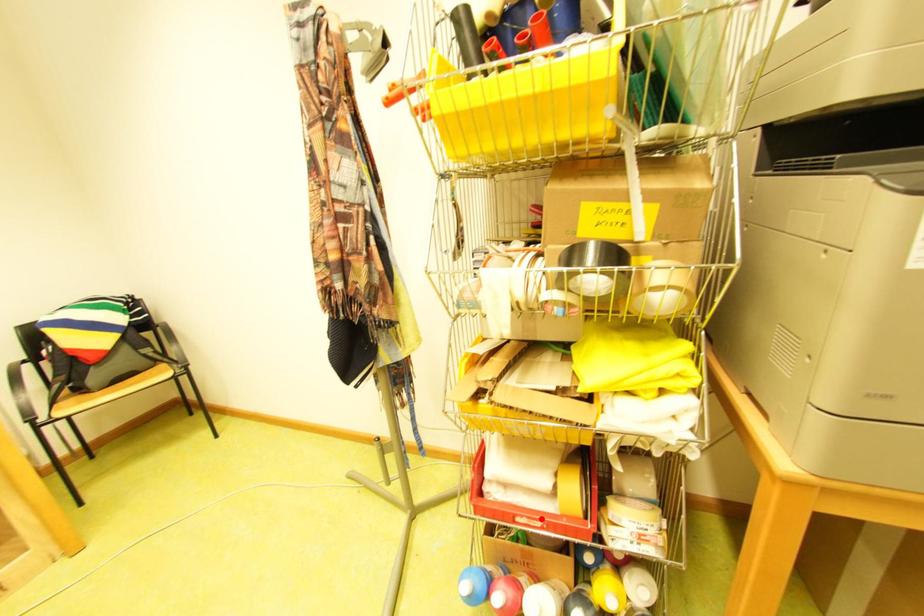
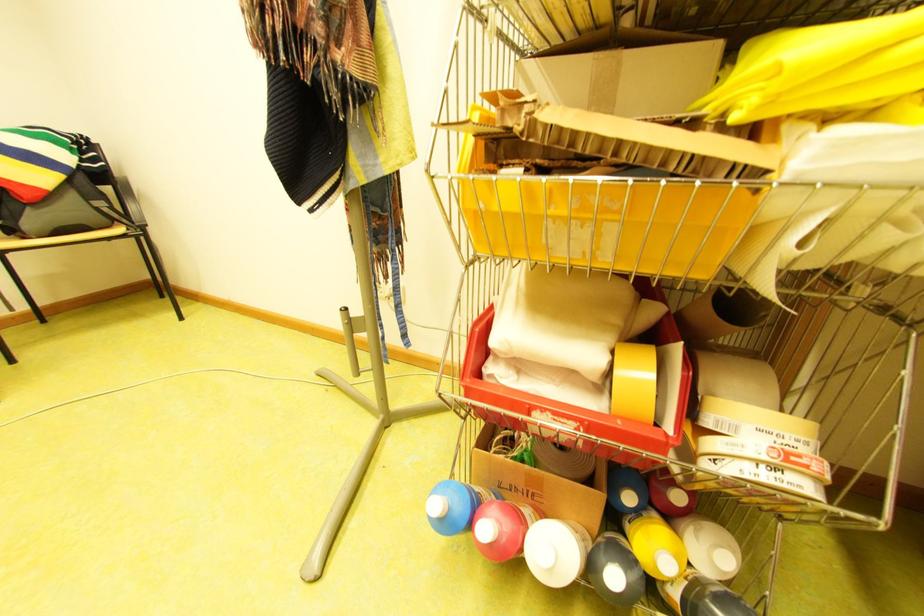
In the second image, find the point that corresponds to the highlighted location in the first image.

(565, 414)